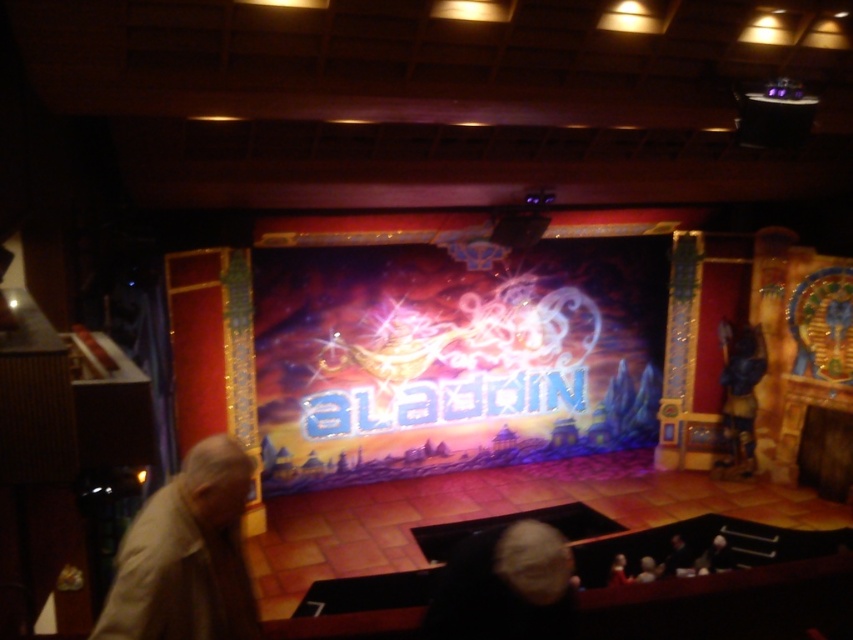
Question: Which point appears farthest from the camera in this image?

Choices:
 (A) (654, 566)
 (B) (610, 573)
 (C) (152, 545)

Answer: (A)

Question: Which object is closer to the camera taking this photo?

Choices:
 (A) light beige hair at lower center
 (B) light beige fabric at lower left

Answer: (B)

Question: Does light beige hair at lower center appear on the left side of dark hair at center?

Choices:
 (A) yes
 (B) no

Answer: (A)

Question: Does light beige fabric at lower left appear under dark hair at center?

Choices:
 (A) no
 (B) yes

Answer: (A)

Question: Does light beige fabric at lower left appear on the left side of light beige hair at lower center?

Choices:
 (A) no
 (B) yes

Answer: (B)

Question: Which object is closer to the camera taking this photo?

Choices:
 (A) dark hair at center
 (B) light beige hair at lower center
 (C) light beige fabric at lower left

Answer: (C)